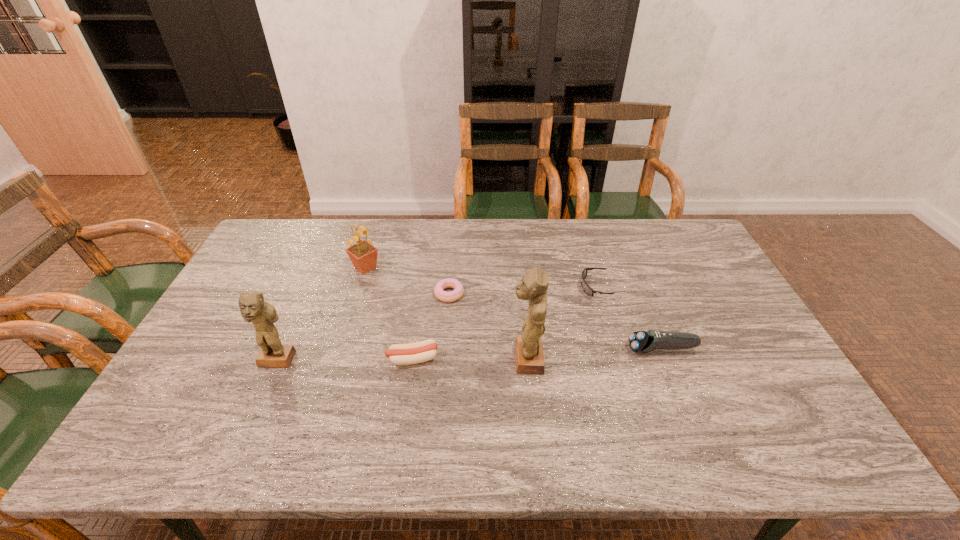
Image resolution: width=960 pixels, height=540 pixels. I want to click on free space between the tallest object and the goggles, so click(x=564, y=323).

Locate an element on the screen. The width and height of the screenshot is (960, 540). vacant point located between the sunflower and the leftmost object is located at coordinates (321, 314).

I want to click on empty space between the tallest object and the doughnut, so click(x=488, y=326).

Find the location of `unoccupied position between the leftmost object and the sunflower`. unoccupied position between the leftmost object and the sunflower is located at coordinates (321, 314).

The image size is (960, 540). I want to click on free space between the doughnut and the shorter figurine, so click(363, 327).

I want to click on free space between the goggles and the sausage, so click(507, 323).

Identify the location of free space between the fifth object from left to right and the sausage. The height and width of the screenshot is (540, 960). (469, 359).

In order to click on unoccupied position between the sausage and the shorter figurine in this screenshot , I will do `click(345, 360)`.

Where is `vacant space that is in between the third object from right to left and the goggles`? vacant space that is in between the third object from right to left and the goggles is located at coordinates (564, 323).

Identify which object is located as the nearest to the fourth shortest object. Please provide its 2D coordinates. Your answer should be formatted as a tuple, i.e. [(x, y)], where the tuple contains the x and y coordinates of a point satisfying the conditions above.

[(588, 290)]